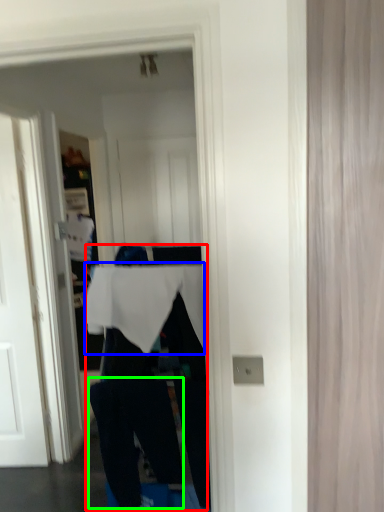
Question: Which object is positioned farthest from person (highlighted by a red box)? Select from tablecloth (highlighted by a blue box) and trousers (highlighted by a green box).

Choices:
 (A) tablecloth
 (B) trousers

Answer: (A)